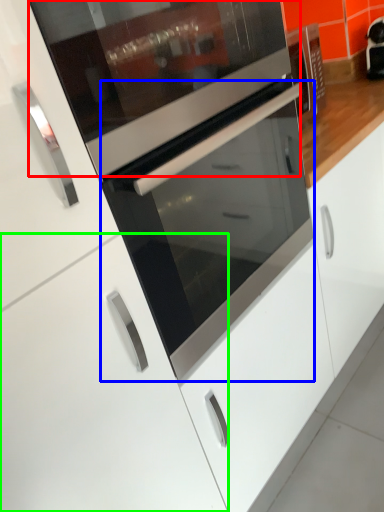
Question: Considering the real-world distances, which object is closest to appliance (highlighted by a red box)? oven (highlighted by a blue box) or cabinetry (highlighted by a green box).

Choices:
 (A) oven
 (B) cabinetry

Answer: (A)